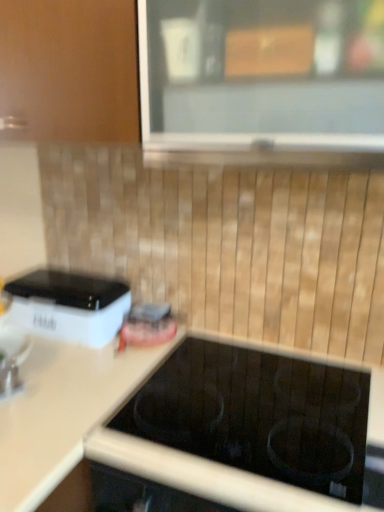
Question: Should I look upward or downward to see white matte countertop at center?

Choices:
 (A) down
 (B) up

Answer: (A)

Question: Does white matte countertop at center have a smaller size compared to metallic faucet at lower left?

Choices:
 (A) yes
 (B) no

Answer: (B)

Question: Does white matte countertop at center come behind metallic faucet at lower left?

Choices:
 (A) yes
 (B) no

Answer: (B)

Question: Does white matte countertop at center appear on the left side of metallic faucet at lower left?

Choices:
 (A) yes
 (B) no

Answer: (B)

Question: From a real-world perspective, is white matte countertop at center positioned over metallic faucet at lower left based on gravity?

Choices:
 (A) no
 (B) yes

Answer: (A)

Question: Is white matte countertop at center closer to camera compared to metallic faucet at lower left?

Choices:
 (A) no
 (B) yes

Answer: (B)

Question: Can you confirm if white matte countertop at center is bigger than metallic faucet at lower left?

Choices:
 (A) yes
 (B) no

Answer: (A)

Question: Is white matte countertop at center at the back of clear glass window at upper center?

Choices:
 (A) no
 (B) yes

Answer: (A)

Question: Does clear glass window at upper center have a greater width compared to white matte countertop at center?

Choices:
 (A) yes
 (B) no

Answer: (A)

Question: Is clear glass window at upper center bigger than white matte countertop at center?

Choices:
 (A) no
 (B) yes

Answer: (A)

Question: Would you say clear glass window at upper center is a long distance from white matte countertop at center?

Choices:
 (A) yes
 (B) no

Answer: (B)

Question: Is clear glass window at upper center thinner than white matte countertop at center?

Choices:
 (A) no
 (B) yes

Answer: (A)

Question: From a real-world perspective, is clear glass window at upper center on white matte countertop at center?

Choices:
 (A) yes
 (B) no

Answer: (A)

Question: Is white plastic toaster at left turned away from clear glass window at upper center?

Choices:
 (A) yes
 (B) no

Answer: (B)